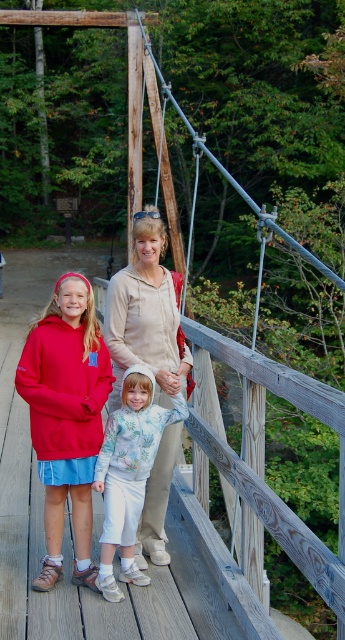
You are a fashion designer observing the two hoodies worn by the children and the adult on the suspension bridge. Given that the matte red hoodie at center is narrower than the beige cotton hoodie at center, which one would you recommend for someone who prefers a looser, more comfortable fit?

The beige cotton hoodie at center has a wider width than the matte red hoodie at center, so it would be more suitable for someone who prefers a looser, more comfortable fit.

You are a photographer positioned at the bridge entrance and want to capture the beige cotton hoodie at center in your shot. Based on its position, where should you aim your camera?

The beige cotton hoodie at center is located at point 0.494 on the x and 0.426 on the y coordinates, so aim your camera towards the center slightly to the right and lower middle of the image to capture it.